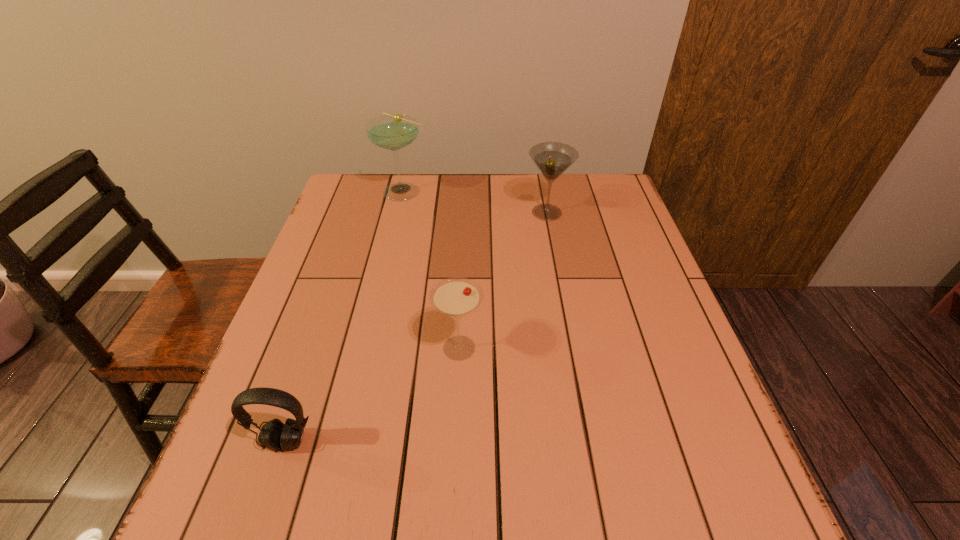
At what (x,y) coordinates should I click in order to perform the action: click on vacant point located between the third farthest object and the rightmost object. Please return your answer as a coordinate pair (x, y). Looking at the image, I should click on (503, 280).

Locate an element on the screen. The width and height of the screenshot is (960, 540). unoccupied area between the shortest martini and the nearest object is located at coordinates (372, 395).

You are a GUI agent. You are given a task and a screenshot of the screen. Output one action in this format:
    pyautogui.click(x=<x>, y=<y>)
    Task: Click on the vacant space that's between the nearest object and the leftmost martini
    The width and height of the screenshot is (960, 540).
    Given the screenshot: What is the action you would take?
    pyautogui.click(x=346, y=316)

At what (x,y) coordinates should I click in order to perform the action: click on free point between the leftmost martini and the nearest martini. Please return your answer as a coordinate pair (x, y). The width and height of the screenshot is (960, 540). Looking at the image, I should click on (432, 269).

Locate an element on the screen. The height and width of the screenshot is (540, 960). empty location between the second object from right to left and the headset is located at coordinates pos(372,395).

Identify the location of vacant region between the leftmost martini and the rightmost object. The image size is (960, 540). (476, 202).

Find the location of a particular element. The width and height of the screenshot is (960, 540). vacant space in between the leftmost martini and the nearest object is located at coordinates (346, 316).

The width and height of the screenshot is (960, 540). What are the coordinates of `object that can be found as the third closest to the rightmost martini` in the screenshot? It's located at (274, 435).

Identify which object is the second nearest to the second martini from right to left. Please provide its 2D coordinates. Your answer should be formatted as a tuple, i.e. [(x, y)], where the tuple contains the x and y coordinates of a point satisfying the conditions above.

[(552, 158)]

Locate which martini ranks second in proximity to the rightmost object. Please provide its 2D coordinates. Your answer should be formatted as a tuple, i.e. [(x, y)], where the tuple contains the x and y coordinates of a point satisfying the conditions above.

[(456, 297)]